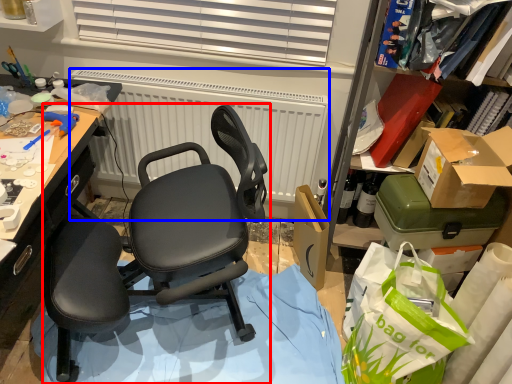
Question: Which of the following is the farthest to the observer, chair (highlighted by a red box) or radiator (highlighted by a blue box)?

Choices:
 (A) chair
 (B) radiator

Answer: (B)